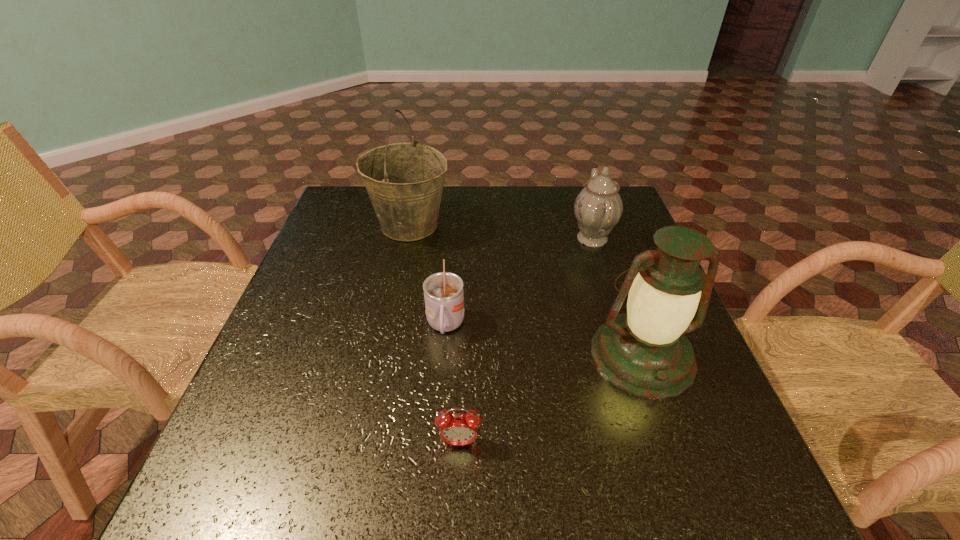
I want to click on wine bucket, so click(x=404, y=181).

You are a GUI agent. You are given a task and a screenshot of the screen. Output one action in this format:
    pyautogui.click(x=<x>, y=<y>)
    Task: Click on the lantern
    This screenshot has width=960, height=540.
    Given the screenshot: What is the action you would take?
    pyautogui.click(x=645, y=352)

Locate an element on the screen. the third tallest object is located at coordinates (598, 207).

Locate an element on the screen. The height and width of the screenshot is (540, 960). cup is located at coordinates (443, 292).

At what (x,y) coordinates should I click in order to perform the action: click on the shortest object. Please return your answer as a coordinate pair (x, y). This screenshot has height=540, width=960. Looking at the image, I should click on [458, 429].

At what (x,y) coordinates should I click in order to perform the action: click on alarm clock. Please return your answer as a coordinate pair (x, y). The width and height of the screenshot is (960, 540). Looking at the image, I should click on (458, 429).

Locate an element on the screen. The image size is (960, 540). vacant space situated 0.200m on the right of the wine bucket is located at coordinates (521, 226).

Locate an element on the screen. The height and width of the screenshot is (540, 960). vacant space located with the light compartment facing forward on the lantern is located at coordinates (668, 429).

Where is `free space located 0.230m on the spout of the third tallest object`? The height and width of the screenshot is (540, 960). free space located 0.230m on the spout of the third tallest object is located at coordinates (486, 238).

Locate an element on the screen. Image resolution: width=960 pixels, height=540 pixels. vacant area situated 0.100m on the spout of the third tallest object is located at coordinates (533, 238).